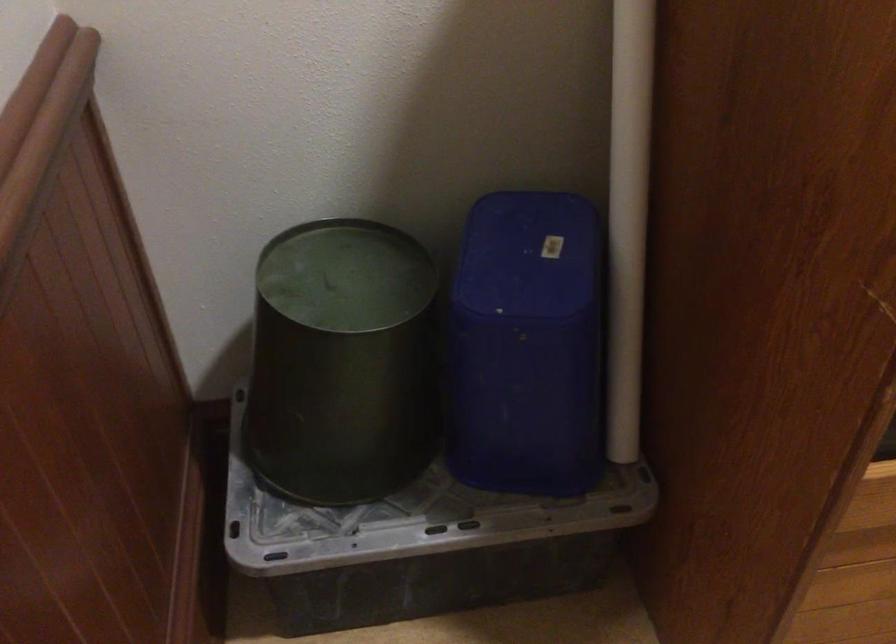
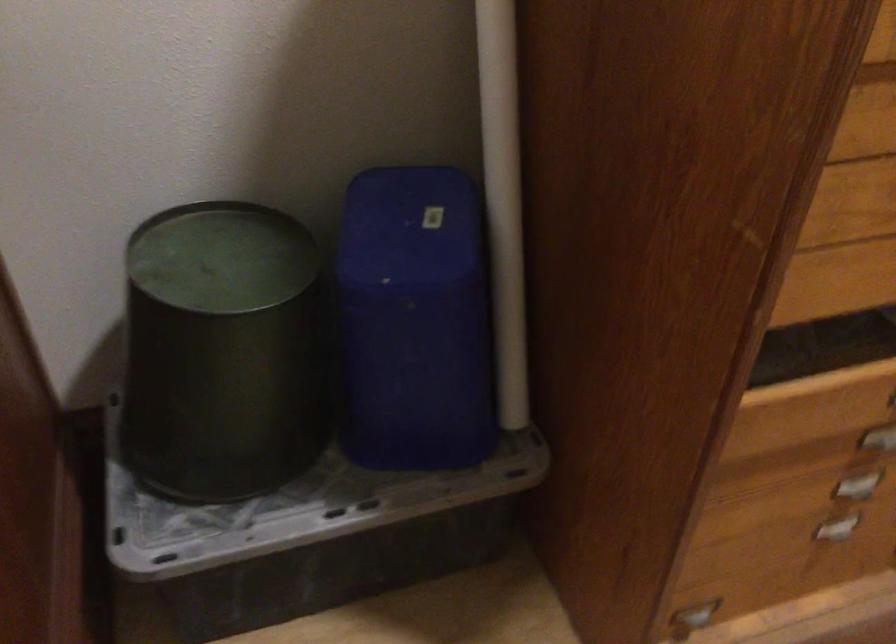
Question: I am providing you with two images of the same scene from different viewpoints. Please identify which objects are invisible in image2.

Choices:
 (A) green round bin
 (B) metal drawer handle
 (C) blue plastic bin
 (D) none of these

Answer: (D)